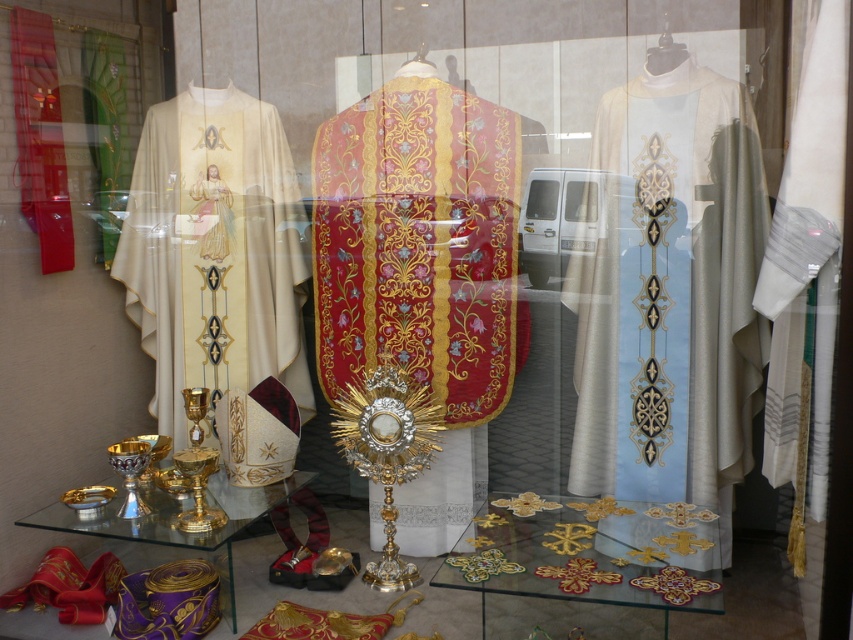
Question: In this image, where is rich red velvet robe at center located relative to matte white robe at left?

Choices:
 (A) left
 (B) right

Answer: (B)

Question: Estimate the real-world distances between objects in this image. Which object is closer to the light blue silk robe at center?

Choices:
 (A) transparent glass table at lower left
 (B) rich red velvet robe at center

Answer: (B)

Question: Can you confirm if transparent glass table at center is thinner than gold embroidered robe at center?

Choices:
 (A) yes
 (B) no

Answer: (B)

Question: Among these objects, which one is farthest from the camera?

Choices:
 (A) gold embroidered robe at center
 (B) transparent glass table at lower left
 (C) rich red velvet robe at center
 (D) transparent glass table at center

Answer: (A)

Question: Which of the following is the closest to the observer?

Choices:
 (A) (636, 145)
 (B) (602, 548)
 (C) (223, 209)
 (D) (316, 202)

Answer: (B)

Question: Is matte white robe at left positioned at the back of gold embroidered robe at center?

Choices:
 (A) yes
 (B) no

Answer: (B)